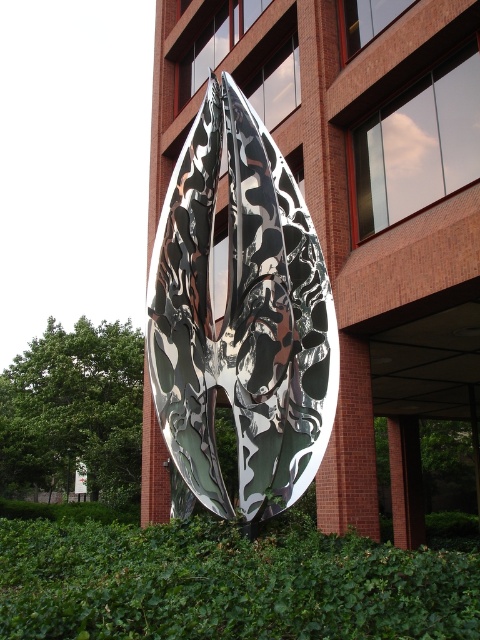
Question: Does green leafy hedge at center have a greater width compared to green leafy hedge at lower left?

Choices:
 (A) yes
 (B) no

Answer: (B)

Question: Among these points, which one is nearest to the camera?

Choices:
 (A) (237, 339)
 (B) (6, 416)

Answer: (A)

Question: Among these objects, which one is farthest from the camera?

Choices:
 (A) metallic reflective leaf at center
 (B) green leafy hedge at lower left
 (C) green leafy hedge at center

Answer: (B)

Question: Among these points, which one is nearest to the camera?

Choices:
 (A) (123, 467)
 (B) (346, 616)

Answer: (B)

Question: Is metallic reflective leaf at center smaller than green leafy hedge at lower left?

Choices:
 (A) yes
 (B) no

Answer: (A)

Question: Can you confirm if metallic reflective leaf at center is positioned above green leafy hedge at center?

Choices:
 (A) no
 (B) yes

Answer: (B)